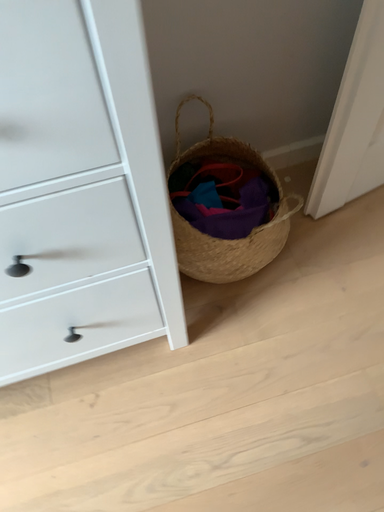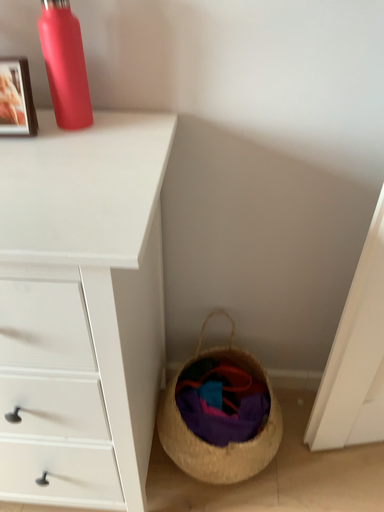
Question: Which way did the camera rotate in the video?

Choices:
 (A) rotated downward
 (B) rotated upward

Answer: (B)